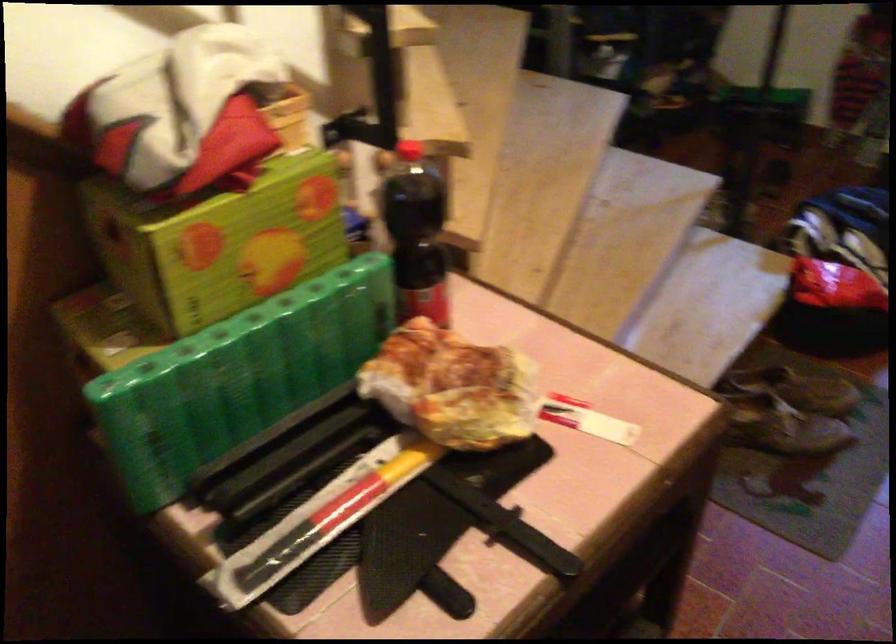
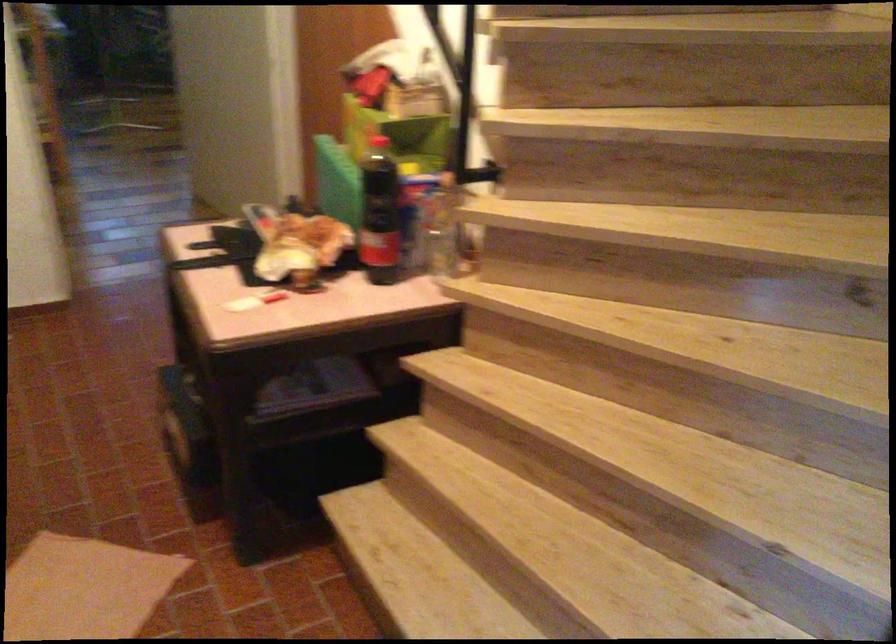
The point at (341, 261) is marked in the first image. Where is the corresponding point in the second image?

(437, 232)